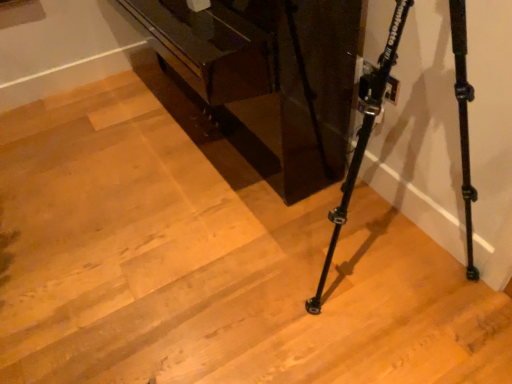
Question: Can you confirm if glossy dark wood piano at center is shorter than black matte tripod at lower right?

Choices:
 (A) yes
 (B) no

Answer: (A)

Question: Is glossy dark wood piano at center taller than black matte tripod at lower right?

Choices:
 (A) no
 (B) yes

Answer: (A)

Question: Are glossy dark wood piano at center and black matte tripod at lower right located far from each other?

Choices:
 (A) no
 (B) yes

Answer: (A)

Question: Is glossy dark wood piano at center positioned beyond the bounds of black matte tripod at lower right?

Choices:
 (A) no
 (B) yes

Answer: (B)

Question: From a real-world perspective, does glossy dark wood piano at center sit lower than black matte tripod at lower right?

Choices:
 (A) no
 (B) yes

Answer: (B)

Question: Is glossy dark wood piano at center turned away from black matte tripod at lower right?

Choices:
 (A) no
 (B) yes

Answer: (A)

Question: Considering the relative sizes of black matte tripod at lower right and glossy dark wood piano at center in the image provided, is black matte tripod at lower right shorter than glossy dark wood piano at center?

Choices:
 (A) yes
 (B) no

Answer: (B)

Question: Considering the relative positions of black matte tripod at lower right and glossy dark wood piano at center in the image provided, is black matte tripod at lower right to the right of glossy dark wood piano at center from the viewer's perspective?

Choices:
 (A) yes
 (B) no

Answer: (A)

Question: Is black matte tripod at lower right outside of glossy dark wood piano at center?

Choices:
 (A) no
 (B) yes

Answer: (B)

Question: Is black matte tripod at lower right to the left of glossy dark wood piano at center from the viewer's perspective?

Choices:
 (A) yes
 (B) no

Answer: (B)

Question: Is the depth of black matte tripod at lower right less than that of glossy dark wood piano at center?

Choices:
 (A) no
 (B) yes

Answer: (B)

Question: Does black matte tripod at lower right have a lesser width compared to glossy dark wood piano at center?

Choices:
 (A) yes
 (B) no

Answer: (A)

Question: Considering their positions, is glossy dark wood piano at center located in front of or behind black matte tripod at lower right?

Choices:
 (A) behind
 (B) front

Answer: (A)